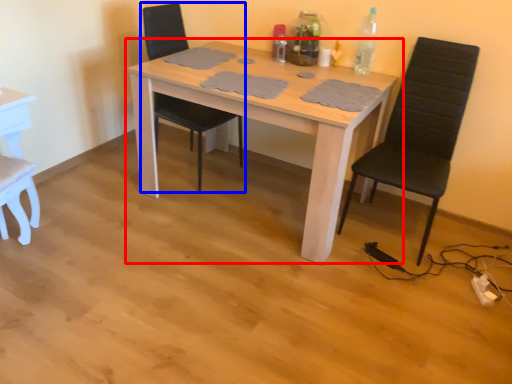
Question: Which point is closer to the camera, table (highlighted by a red box) or chair (highlighted by a blue box)?

Choices:
 (A) table
 (B) chair

Answer: (A)